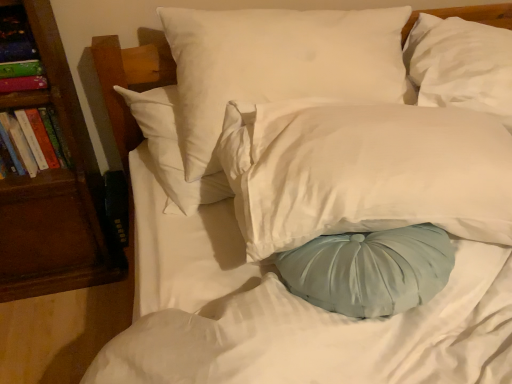
Question: Can you confirm if hardcover book at left, arranged as the 2th book when viewed from the top, is wider than white satin pillow at center, the second pillow viewed from the right?

Choices:
 (A) yes
 (B) no

Answer: (B)

Question: Is white satin pillow at center, the second pillow viewed from the right, at the back of hardcover book at left, the 1th book when ordered from bottom to top?

Choices:
 (A) no
 (B) yes

Answer: (A)

Question: Is white satin pillow at center, arranged as the 2th pillow when viewed from the left, located within hardcover book at left, arranged as the 2th book when viewed from the top?

Choices:
 (A) yes
 (B) no

Answer: (B)

Question: Is hardcover book at left, the 1th book when ordered from bottom to top, positioned in front of white satin pillow at center, the second pillow viewed from the right?

Choices:
 (A) no
 (B) yes

Answer: (A)

Question: Does hardcover book at left, the 1th book when ordered from bottom to top, turn towards white satin pillow at center, the second pillow viewed from the right?

Choices:
 (A) yes
 (B) no

Answer: (B)

Question: Can you confirm if hardcover book at left, the 1th book when ordered from bottom to top, is thinner than white satin pillow at center, arranged as the 2th pillow when viewed from the left?

Choices:
 (A) no
 (B) yes

Answer: (B)

Question: Is brown wood bookshelf at left facing away from multicolored paper book at left, the first book when ordered from top to bottom?

Choices:
 (A) yes
 (B) no

Answer: (A)

Question: Does brown wood bookshelf at left have a larger size compared to multicolored paper book at left, the first book when ordered from top to bottom?

Choices:
 (A) no
 (B) yes

Answer: (B)

Question: Is multicolored paper book at left, the first book when ordered from top to bottom, inside brown wood bookshelf at left?

Choices:
 (A) no
 (B) yes

Answer: (B)

Question: From the image's perspective, is brown wood bookshelf at left beneath multicolored paper book at left, the first book when ordered from top to bottom?

Choices:
 (A) no
 (B) yes

Answer: (B)

Question: Is brown wood bookshelf at left aimed at multicolored paper book at left, the first book when ordered from top to bottom?

Choices:
 (A) no
 (B) yes

Answer: (B)

Question: Is brown wood bookshelf at left located outside multicolored paper book at left, the first book when ordered from top to bottom?

Choices:
 (A) no
 (B) yes

Answer: (B)

Question: Can you confirm if hardcover book at left, the 1th book when ordered from bottom to top, is shorter than brown wood bookshelf at left?

Choices:
 (A) no
 (B) yes

Answer: (B)